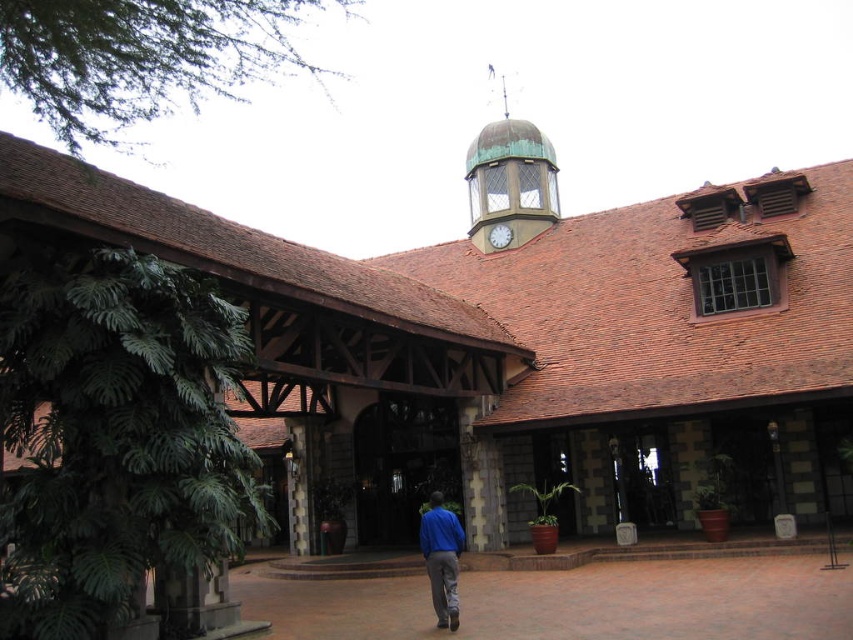
Is green copper clock tower at upper center wider than white glossy clock at center?

Yes.

Between green copper clock tower at upper center and white glossy clock at center, which one appears on the right side from the viewer's perspective?

From the viewer's perspective, green copper clock tower at upper center appears more on the right side.

Is point (508, 244) less distant than point (506, 227)?

Yes, it is.

I want to click on green copper clock tower at upper center, so click(509, 179).

Who is shorter, blue cotton shirt at center or white glossy clock at center?

white glossy clock at center

How much distance is there between blue cotton shirt at center and white glossy clock at center?

They are 52.54 meters apart.

Measure the distance between blue cotton shirt at center and camera.

blue cotton shirt at center and camera are 45.68 meters apart from each other.

Where is `blue cotton shirt at center`? blue cotton shirt at center is located at coordinates (440, 557).

Find the location of a particular element. The image size is (853, 640). green copper clock tower at upper center is located at coordinates (509, 179).

Is green copper clock tower at upper center smaller than blue cotton shirt at center?

Incorrect, green copper clock tower at upper center is not smaller in size than blue cotton shirt at center.

Is point (550, 177) positioned before point (451, 600)?

No, it is behind (451, 600).

Where is `green copper clock tower at upper center`? green copper clock tower at upper center is located at coordinates (509, 179).